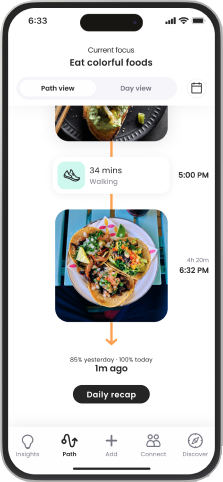
You are a GUI agent. You are given a task and a screenshot of the screen. Output one action in this format:
    pyautogui.click(x=<x>, y=<y>)
    Task: Click on the calendar
    This screenshot has height=482, width=223.
    Given the screenshot: What is the action you would take?
    pyautogui.click(x=198, y=87)